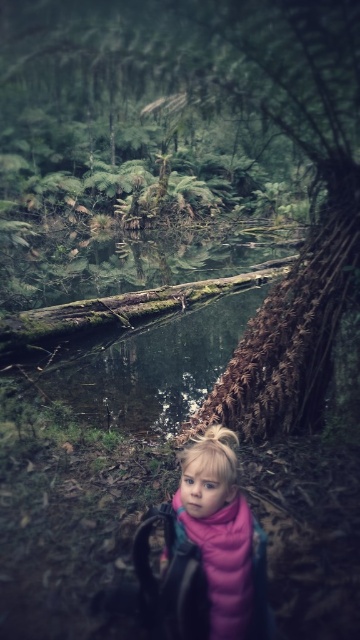
Is brown textured log at center smaller than pink fleece jacket at center?

No, brown textured log at center is not smaller than pink fleece jacket at center.

Does brown textured log at center have a greater height compared to pink fleece jacket at center?

Yes.

Between point (174, 20) and point (213, 600), which one is positioned behind?

The point (174, 20) is more distant.

Locate an element on the screen. The width and height of the screenshot is (360, 640). brown textured log at center is located at coordinates (254, 116).